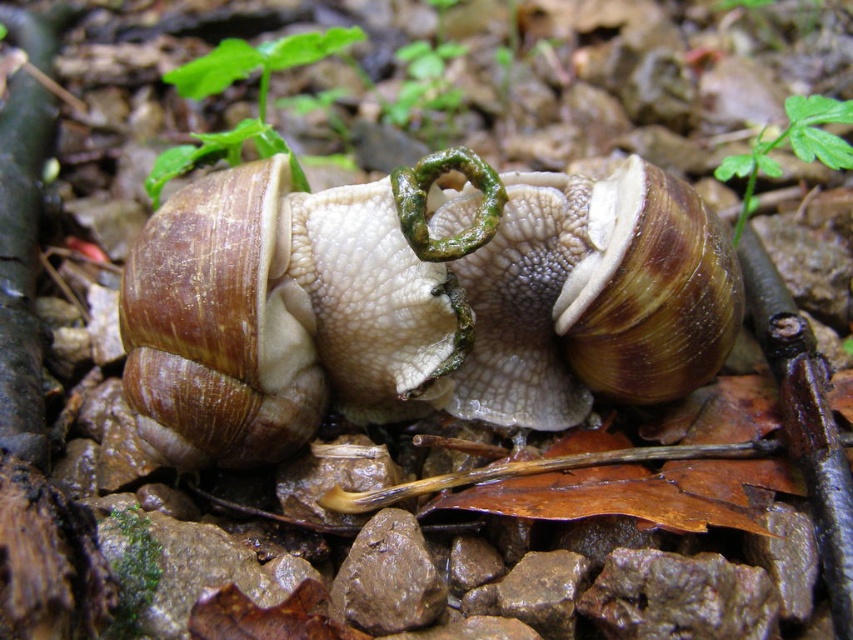
Does matte brown shell at center appear over brown textured shell at center?

Yes, matte brown shell at center is above brown textured shell at center.

From the picture: Between matte brown shell at center and brown textured shell at center, which one has less height?

With less height is brown textured shell at center.

Between point (415, 244) and point (575, 212), which one is positioned in front?

Point (415, 244) is more forward.

Image resolution: width=853 pixels, height=640 pixels. What are the coordinates of `matte brown shell at center` in the screenshot? It's located at (287, 307).